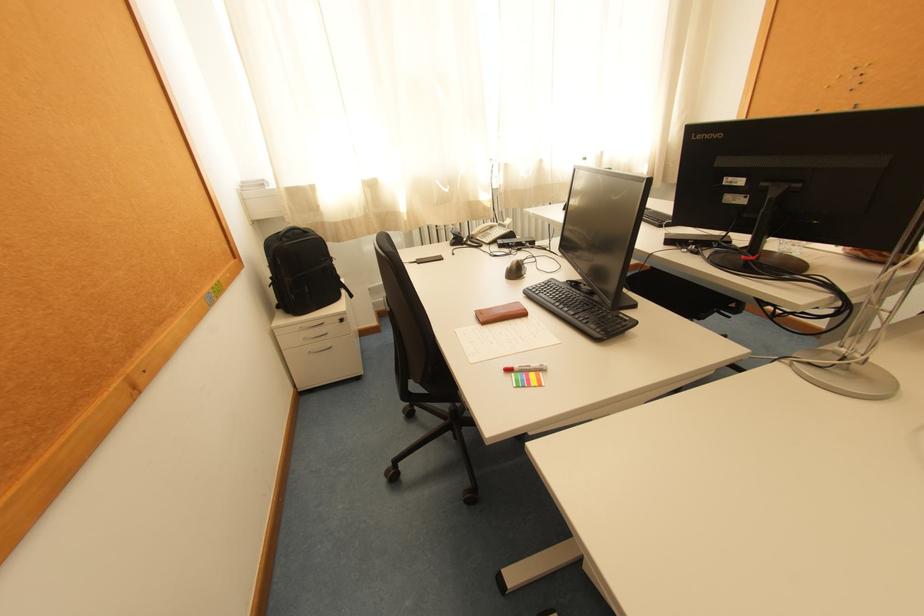
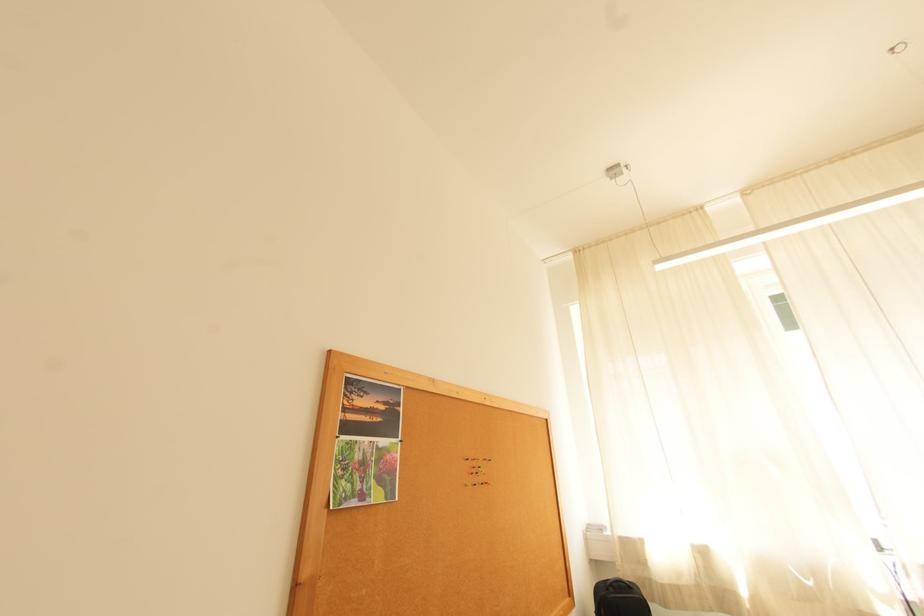
The point at [293,240] is marked in the first image. Where is the corresponding point in the second image?

(619, 591)